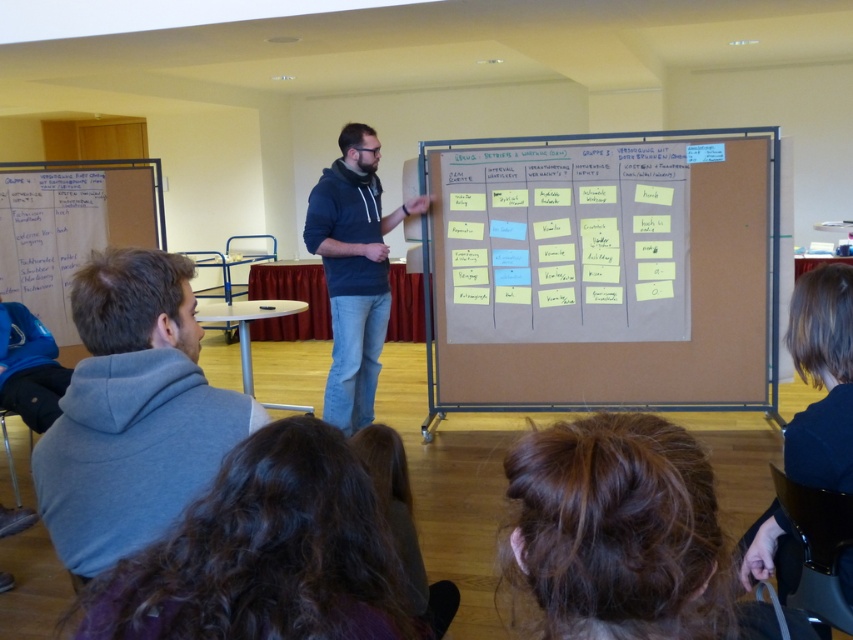
How distant is cardboard poster at center from white paperboard at left?

cardboard poster at center is 8.13 feet away from white paperboard at left.

The image size is (853, 640). Describe the element at coordinates (566, 243) in the screenshot. I see `cardboard poster at center` at that location.

The height and width of the screenshot is (640, 853). Find the location of `cardboard poster at center`. cardboard poster at center is located at coordinates (566, 243).

Who is more distant from viewer, (210, 451) or (35, 209)?

The point (35, 209) is more distant.

In order to click on gray hoodie at lower left in this screenshot , I will do `click(132, 412)`.

Between gray hoodie at lower left and dark blue hoodie at center, which one is positioned lower?

gray hoodie at lower left is below.

Does point (126, 323) come behind point (337, 221)?

No, it is not.

The height and width of the screenshot is (640, 853). In order to click on gray hoodie at lower left in this screenshot , I will do `click(132, 412)`.

Identify the location of gray hoodie at lower left. This screenshot has height=640, width=853. (132, 412).